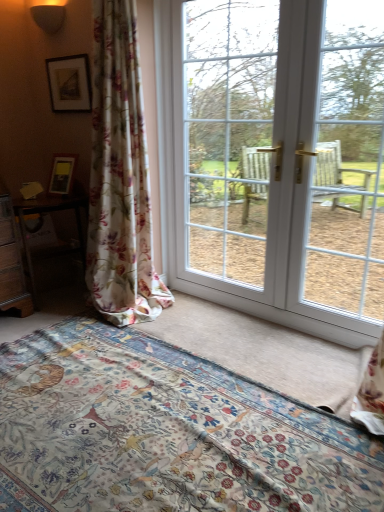
Locate an element on the screen. The image size is (384, 512). free spot above matte black sconce at upper left (from a real-world perspective) is located at coordinates 40,7.